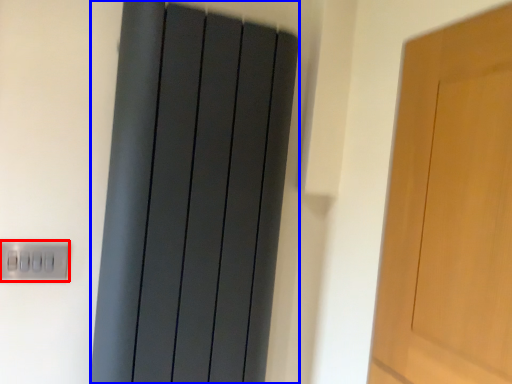
Question: Which point is closer to the camera, electric outlet (highlighted by a red box) or curtain (highlighted by a blue box)?

Choices:
 (A) electric outlet
 (B) curtain

Answer: (B)